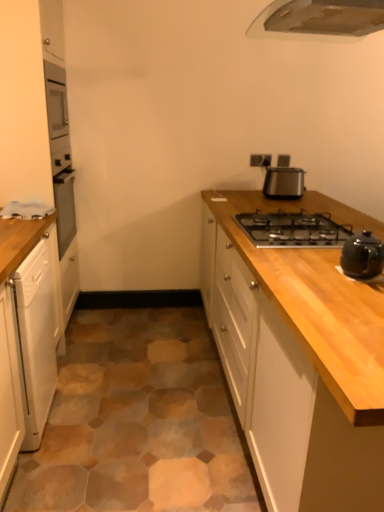
The image size is (384, 512). What are the coordinates of `vacant area situated to the left side of black ceramic teapot at right, the 1th kitchen appliance from the bottom` in the screenshot? It's located at (317, 273).